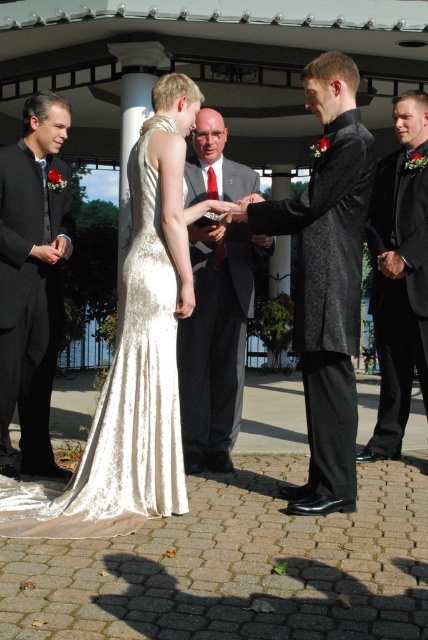
Can you confirm if shiny black suit at center is positioned below matte black suit at left?

Yes, shiny black suit at center is below matte black suit at left.

Which is in front, point (329, 406) or point (35, 304)?

Point (329, 406) is in front.

You are a GUI agent. You are given a task and a screenshot of the screen. Output one action in this format:
    pyautogui.click(x=<x>, y=<y>)
    Task: Click on the shiny black suit at center
    The height and width of the screenshot is (640, 428).
    Given the screenshot: What is the action you would take?
    pyautogui.click(x=326, y=280)

In the scene shown: Is matte gray suit at center wider than black satin tuxedo at right?

Indeed, matte gray suit at center has a greater width compared to black satin tuxedo at right.

Does matte gray suit at center appear over black satin tuxedo at right?

Actually, matte gray suit at center is below black satin tuxedo at right.

Is point (199, 376) closer to camera compared to point (386, 445)?

Yes, point (199, 376) is closer to viewer.

Find the location of a particular element. matte gray suit at center is located at coordinates (214, 348).

What do you see at coordinates (32, 280) in the screenshot? I see `matte black suit at left` at bounding box center [32, 280].

Where is `matte black suit at left`? This screenshot has height=640, width=428. matte black suit at left is located at coordinates (32, 280).

Locate an element on the screen. Image resolution: width=428 pixels, height=640 pixels. matte black suit at left is located at coordinates (32, 280).